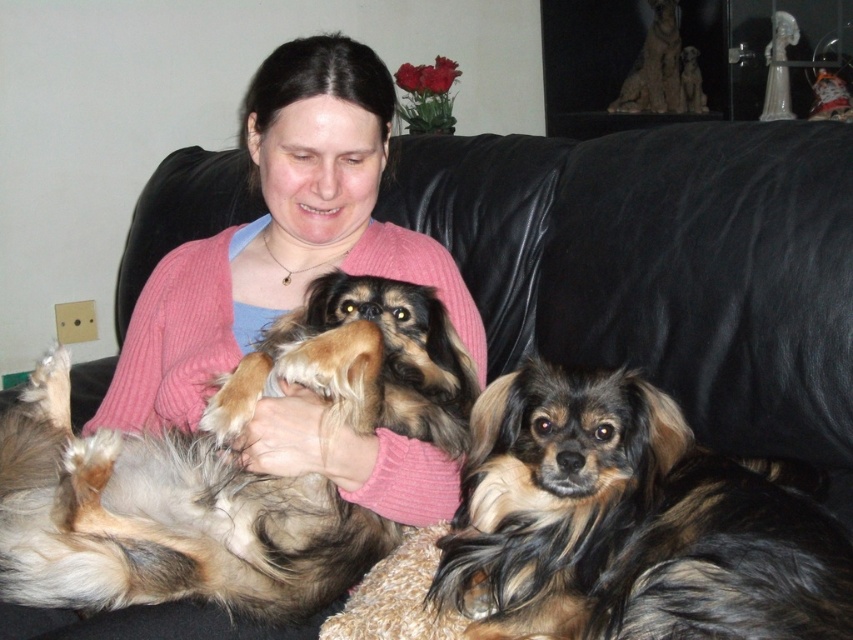
Identify the location of shaggy brown fur at right. (628, 524).

Is shaggy brown fur at right to the right of pink knitted sweater at upper center from the viewer's perspective?

Correct, you'll find shaggy brown fur at right to the right of pink knitted sweater at upper center.

What are the coordinates of `shaggy brown fur at right` in the screenshot? It's located at (628, 524).

Is shaggy brown dog at center taller than pink knitted sweater at upper center?

No.

The image size is (853, 640). Find the location of `shaggy brown dog at center`. shaggy brown dog at center is located at coordinates (228, 468).

Is point (7, 502) farther from camera compared to point (335, 102)?

No, it is in front of (335, 102).

Where is `shaggy brown dog at center`? shaggy brown dog at center is located at coordinates (228, 468).

Can you confirm if shaggy brown dog at center is wider than shaggy brown fur at right?

Indeed, shaggy brown dog at center has a greater width compared to shaggy brown fur at right.

Does shaggy brown dog at center come behind shaggy brown fur at right?

Yes, shaggy brown dog at center is further from the viewer.

Which is in front, point (439, 387) or point (450, 552)?

Point (450, 552) is in front.

What are the coordinates of `shaggy brown dog at center` in the screenshot? It's located at (228, 468).